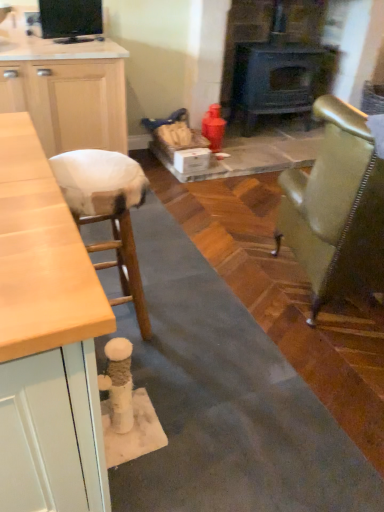
Question: Is dark gray cast iron wood burning stove at center at the right side of metallic gold chair at right?

Choices:
 (A) no
 (B) yes

Answer: (A)

Question: Is dark gray cast iron wood burning stove at center smaller than metallic gold chair at right?

Choices:
 (A) no
 (B) yes

Answer: (B)

Question: Is the surface of dark gray cast iron wood burning stove at center in direct contact with metallic gold chair at right?

Choices:
 (A) no
 (B) yes

Answer: (A)

Question: Is the depth of dark gray cast iron wood burning stove at center less than that of metallic gold chair at right?

Choices:
 (A) no
 (B) yes

Answer: (A)

Question: Considering the relative sizes of dark gray cast iron wood burning stove at center and metallic gold chair at right in the image provided, is dark gray cast iron wood burning stove at center taller than metallic gold chair at right?

Choices:
 (A) no
 (B) yes

Answer: (B)

Question: From a real-world perspective, is metallic gold chair at right above or below white fabric stool at left?

Choices:
 (A) above
 (B) below

Answer: (A)

Question: Is point (334, 202) closer or farther from the camera than point (117, 303)?

Choices:
 (A) closer
 (B) farther

Answer: (A)

Question: Is metallic gold chair at right spatially inside white fabric stool at left, or outside of it?

Choices:
 (A) outside
 (B) inside

Answer: (A)

Question: Considering the positions of metallic gold chair at right and white fabric stool at left in the image, is metallic gold chair at right bigger or smaller than white fabric stool at left?

Choices:
 (A) big
 (B) small

Answer: (A)

Question: Visually, is dark gray cast iron wood burning stove at center positioned to the left or to the right of white fabric stool at left?

Choices:
 (A) left
 (B) right

Answer: (B)

Question: Considering their positions, is dark gray cast iron wood burning stove at center located in front of or behind white fabric stool at left?

Choices:
 (A) behind
 (B) front

Answer: (A)

Question: Considering the positions of dark gray cast iron wood burning stove at center and white fabric stool at left in the image, is dark gray cast iron wood burning stove at center bigger or smaller than white fabric stool at left?

Choices:
 (A) small
 (B) big

Answer: (B)

Question: From a real-world perspective, relative to white fabric stool at left, is dark gray cast iron wood burning stove at center vertically above or below?

Choices:
 (A) above
 (B) below

Answer: (A)

Question: In terms of height, does dark gray cast iron wood burning stove at center look taller or shorter compared to metallic gold chair at right?

Choices:
 (A) tall
 (B) short

Answer: (A)

Question: Considering their positions, is dark gray cast iron wood burning stove at center located in front of or behind metallic gold chair at right?

Choices:
 (A) behind
 (B) front

Answer: (A)